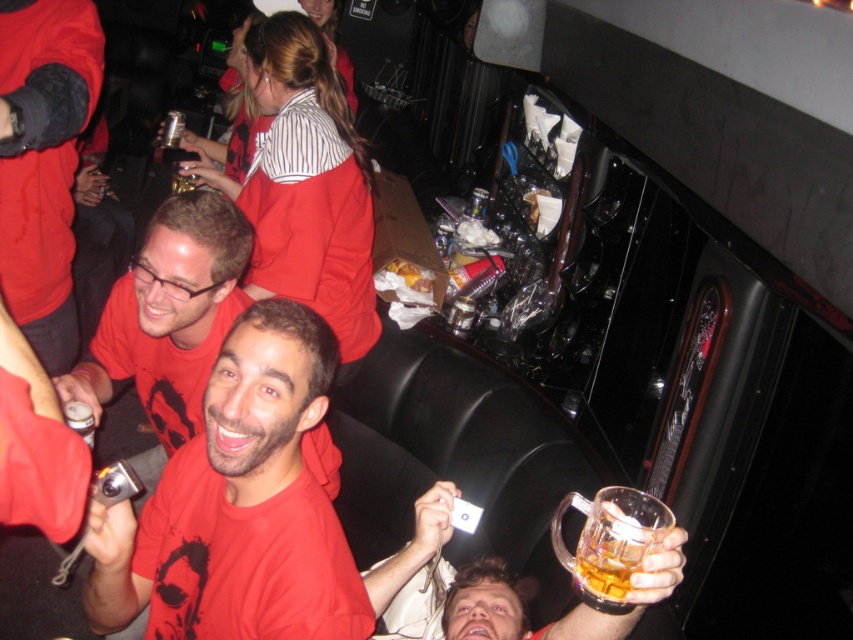
Question: Is the position of matte red t-shirt at center less distant than that of metallic silver can at lower left?

Choices:
 (A) yes
 (B) no

Answer: (A)

Question: Where is matte red t-shirt at center located in relation to matte red shirt at center in the image?

Choices:
 (A) right
 (B) left

Answer: (A)

Question: Which point is farther to the camera?

Choices:
 (A) (663, 531)
 (B) (238, 604)
 (C) (80, 424)
 (D) (48, 172)

Answer: (D)

Question: Among these objects, which one is farthest from the camera?

Choices:
 (A) matte black shirt at upper left
 (B) translucent glass mug at lower right
 (C) matte red shirt at center
 (D) matte red t-shirt at center

Answer: (C)

Question: Does matte red t-shirt at center appear on the right side of translucent glass mug at lower right?

Choices:
 (A) no
 (B) yes

Answer: (A)

Question: Which of the following is the closest to the observer?

Choices:
 (A) matte black shirt at upper left
 (B) translucent glass mug at lower right

Answer: (B)